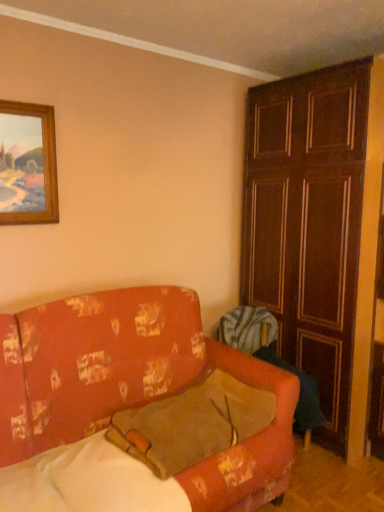
Question: Is wooden panelled door at right spatially inside wooden picture frame at upper left, or outside of it?

Choices:
 (A) inside
 (B) outside

Answer: (B)

Question: From a real-world perspective, is wooden panelled door at right positioned above or below wooden picture frame at upper left?

Choices:
 (A) above
 (B) below

Answer: (B)

Question: Estimate the real-world distances between objects in this image. Which object is closer to the brown suede pillow at center?

Choices:
 (A) floral-patterned fabric couch at lower left
 (B) wooden panelled door at right
 (C) wooden picture frame at upper left

Answer: (A)

Question: Which of these objects is positioned closest to the wooden panelled door at right?

Choices:
 (A) brown suede pillow at center
 (B) wooden picture frame at upper left
 (C) floral-patterned fabric couch at lower left

Answer: (A)